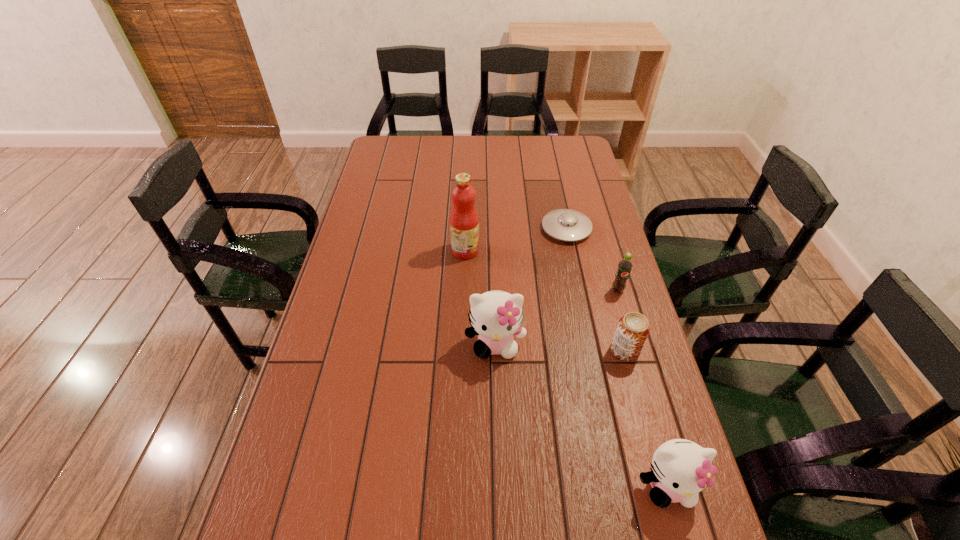
This screenshot has height=540, width=960. I want to click on the left kitten, so click(x=496, y=316).

Locate an element on the screen. This screenshot has height=540, width=960. the farther kitten is located at coordinates (496, 316).

Image resolution: width=960 pixels, height=540 pixels. I want to click on the nearer kitten, so click(681, 469).

I want to click on the right kitten, so click(681, 469).

I want to click on fruit juice, so click(464, 222).

What are the coordinates of `saucer` in the screenshot? It's located at (568, 225).

This screenshot has height=540, width=960. I want to click on the fifth tallest object, so click(633, 328).

Identify the location of the third farthest object. (625, 265).

At what (x,y) coordinates should I click in order to perform the action: click on free space located 0.350m on the front-facing side of the left kitten. Please return your answer as a coordinate pair (x, y). Looking at the image, I should click on (500, 504).

I want to click on vacant space located 0.280m on the front label of the fruit juice, so click(x=563, y=251).